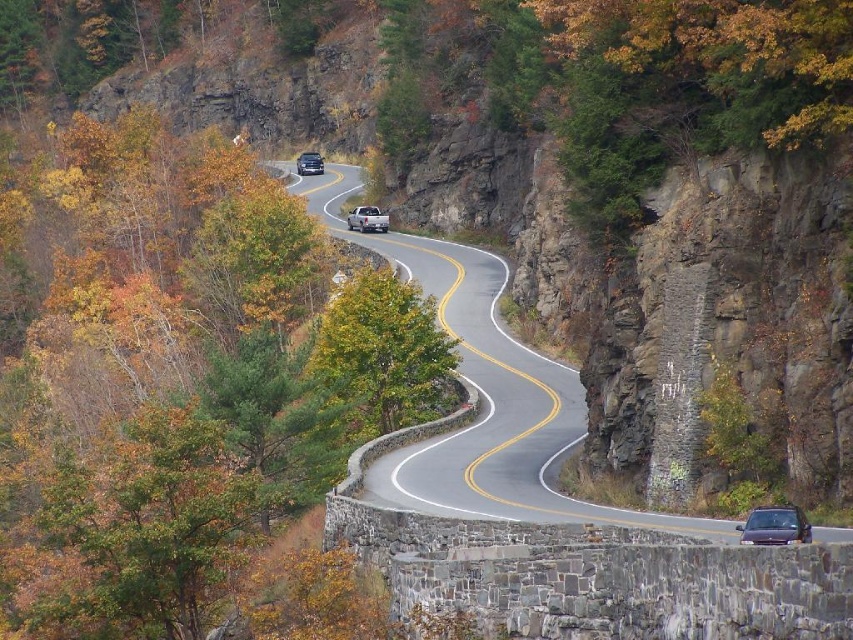
Does smooth asphalt road at center appear over satin black suv at center?

Actually, smooth asphalt road at center is below satin black suv at center.

Which is more to the left, smooth asphalt road at center or satin black suv at center?

satin black suv at center

This screenshot has width=853, height=640. What do you see at coordinates (485, 394) in the screenshot?
I see `smooth asphalt road at center` at bounding box center [485, 394].

Identify the location of smooth asphalt road at center. (485, 394).

Is metallic purple sedan at lower right below satin silver truck at center?

Correct, metallic purple sedan at lower right is located below satin silver truck at center.

Between metallic purple sedan at lower right and satin silver truck at center, which one is positioned higher?

satin silver truck at center

Describe the element at coordinates (775, 525) in the screenshot. I see `metallic purple sedan at lower right` at that location.

Find the location of `metallic purple sedan at lower right`. metallic purple sedan at lower right is located at coordinates 775,525.

In the scene shown: Between smooth asphalt road at center and satin silver truck at center, which one is positioned higher?

satin silver truck at center is higher up.

Is point (486, 476) behind point (357, 209)?

That is False.

The width and height of the screenshot is (853, 640). I want to click on smooth asphalt road at center, so click(485, 394).